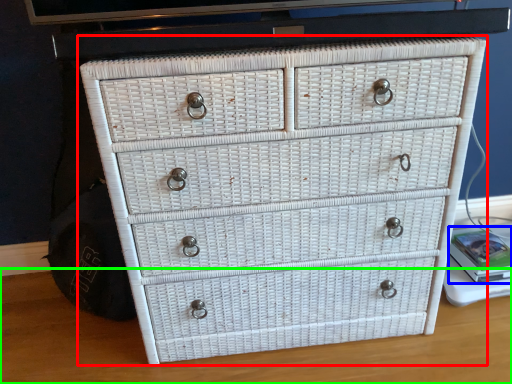
Question: Considering the real-world distances, which object is closest to chest of drawers (highlighted by a red box)? book (highlighted by a blue box) or table top (highlighted by a green box).

Choices:
 (A) book
 (B) table top

Answer: (B)